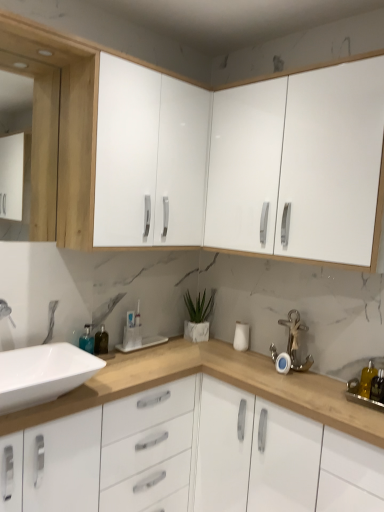
Where is `vacant space positioned to the left of translucent plastic bottle at lower right`? vacant space positioned to the left of translucent plastic bottle at lower right is located at coordinates (340, 396).